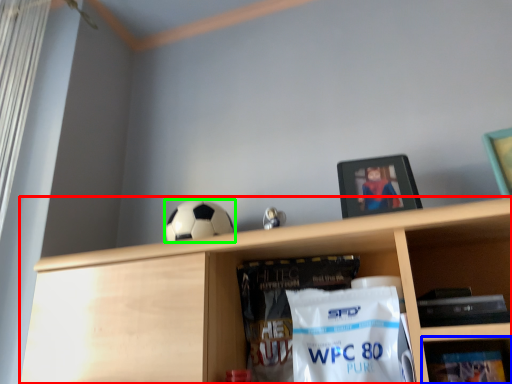
Question: Which is farther away from shelf (highlighted by a red box)? shelf (highlighted by a blue box) or football (highlighted by a green box)?

Choices:
 (A) shelf
 (B) football

Answer: (A)